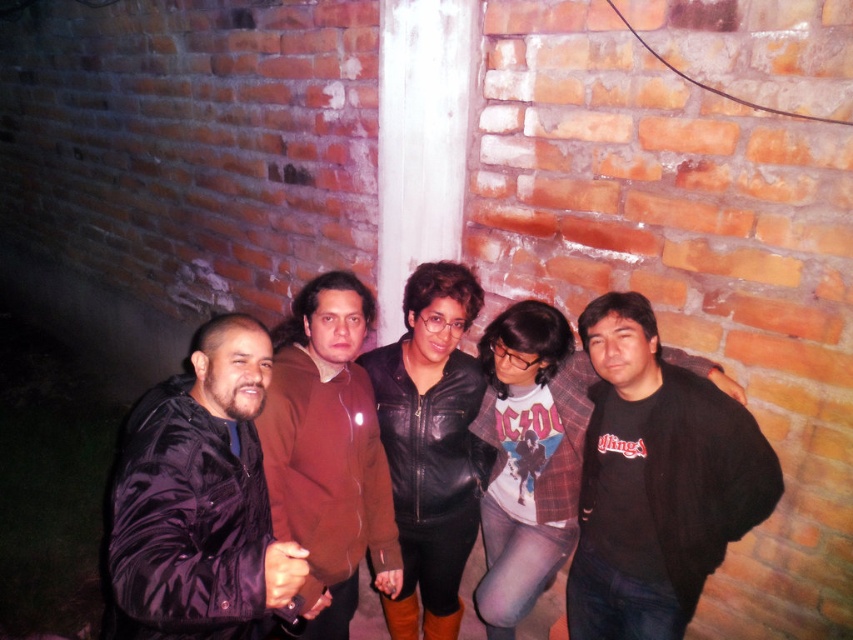
This screenshot has height=640, width=853. What do you see at coordinates (656, 481) in the screenshot?
I see `black cotton t-shirt at center` at bounding box center [656, 481].

Between point (654, 534) and point (158, 536), which one is positioned in front?

Point (158, 536)

Identify the location of black cotton t-shirt at center. Image resolution: width=853 pixels, height=640 pixels. (656, 481).

Does black cotton t-shirt at center appear on the left side of black leather jacket at center?

Incorrect, black cotton t-shirt at center is not on the left side of black leather jacket at center.

Can you confirm if black cotton t-shirt at center is shorter than black leather jacket at center?

Correct, black cotton t-shirt at center is not as tall as black leather jacket at center.

The image size is (853, 640). Describe the element at coordinates (656, 481) in the screenshot. I see `black cotton t-shirt at center` at that location.

This screenshot has height=640, width=853. Identify the location of black cotton t-shirt at center. (656, 481).

Which is behind, point (326, 481) or point (416, 625)?

The point (416, 625) is more distant.

The image size is (853, 640). I want to click on brown sweater at center, so click(x=328, y=451).